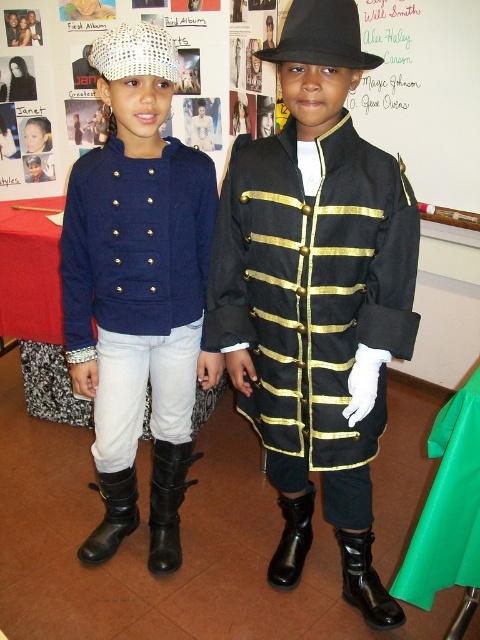
Question: Does black matte coat at center lie in front of white paper at upper center?

Choices:
 (A) yes
 (B) no

Answer: (A)

Question: Among these points, which one is farthest from the camera?

Choices:
 (A) (278, 67)
 (B) (95, 557)

Answer: (B)

Question: Does black matte coat at center appear over black felt fedora at upper center?

Choices:
 (A) yes
 (B) no

Answer: (B)

Question: Can you confirm if white paper at upper center is positioned to the right of black felt fedora at upper center?

Choices:
 (A) no
 (B) yes

Answer: (A)

Question: Among these objects, which one is nearest to the camera?

Choices:
 (A) black rubber boot at lower right
 (B) white woven hat at upper left

Answer: (B)

Question: Which object is positioned closest to the white paper at upper center?

Choices:
 (A) black leather boot at lower left
 (B) black matte coat at center
 (C) black leather boot at lower center

Answer: (B)